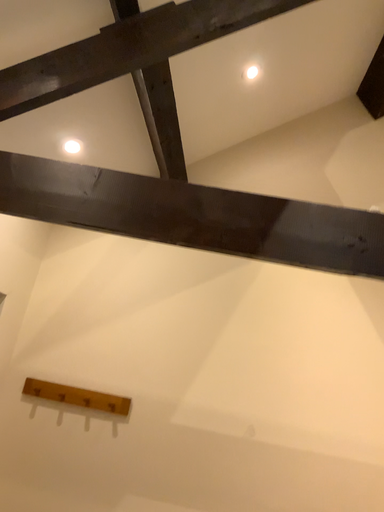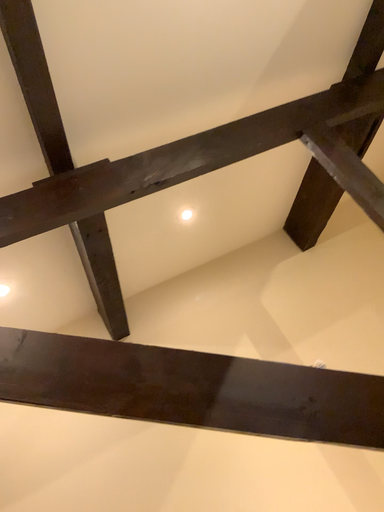
Question: How did the camera likely rotate when shooting the video?

Choices:
 (A) rotated left
 (B) rotated right

Answer: (B)